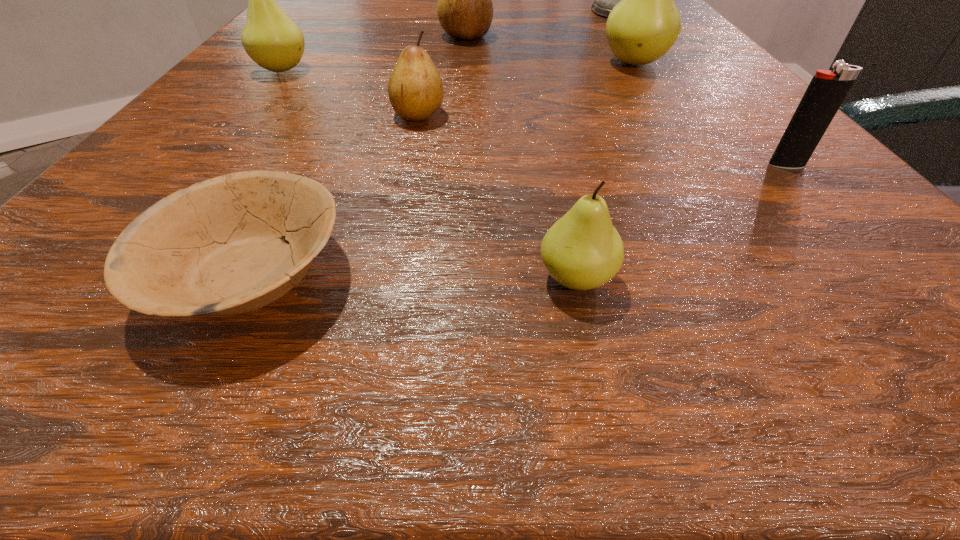
Identify which pear is located as the second nearest to the second biggest green pear. Please provide its 2D coordinates. Your answer should be formatted as a tuple, i.e. [(x, y)], where the tuple contains the x and y coordinates of a point satisfying the conditions above.

[(465, 11)]

Locate which pear is the second closest to the third nearest object. Please provide its 2D coordinates. Your answer should be formatted as a tuple, i.e. [(x, y)], where the tuple contains the x and y coordinates of a point satisfying the conditions above.

[(582, 250)]

Point out which green pear is positioned as the nearest to the farthest object. Please provide its 2D coordinates. Your answer should be formatted as a tuple, i.e. [(x, y)], where the tuple contains the x and y coordinates of a point satisfying the conditions above.

[(644, 25)]

Locate which green pear is the third closest to the shortest object. Please provide its 2D coordinates. Your answer should be formatted as a tuple, i.e. [(x, y)], where the tuple contains the x and y coordinates of a point satisfying the conditions above.

[(644, 25)]

Identify the location of vacant area in the image that satisfies the following two spatial constraints: 1. on the front side of the fourth nearest object; 2. on the right side of the nearest pear. This screenshot has height=540, width=960. (384, 278).

Identify the location of free space that satisfies the following two spatial constraints: 1. on the back side of the bowl; 2. on the right side of the farthest pear. The image size is (960, 540). (371, 36).